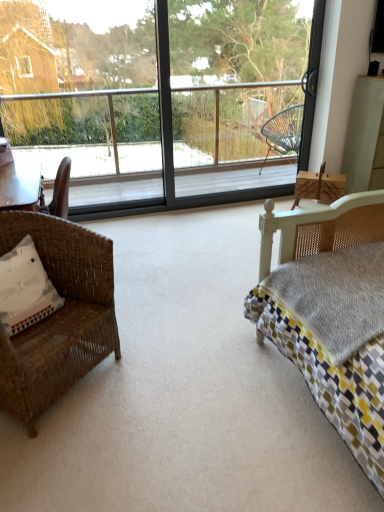
Question: Considering the relative positions of transparent glass window at center and woven brown chair at left in the image provided, is transparent glass window at center to the left or to the right of woven brown chair at left?

Choices:
 (A) left
 (B) right

Answer: (B)

Question: Considering their positions, is transparent glass window at center located in front of or behind woven brown chair at left?

Choices:
 (A) front
 (B) behind

Answer: (B)

Question: Which is nearer to the transparent glass window at center?

Choices:
 (A) white fabric pillow at left
 (B) woven brown chair at left
 (C) transparent glass screen door at center

Answer: (C)

Question: Estimate the real-world distances between objects in this image. Which object is farther from the woven brown chair at left?

Choices:
 (A) white fabric pillow at left
 (B) transparent glass window at center
 (C) transparent glass screen door at center

Answer: (C)